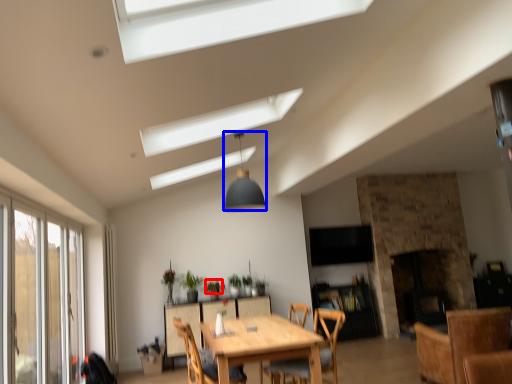
Question: Which object appears closest to the camera in this image, plant (highlighted by a red box) or light fixture (highlighted by a blue box)?

Choices:
 (A) plant
 (B) light fixture

Answer: (B)